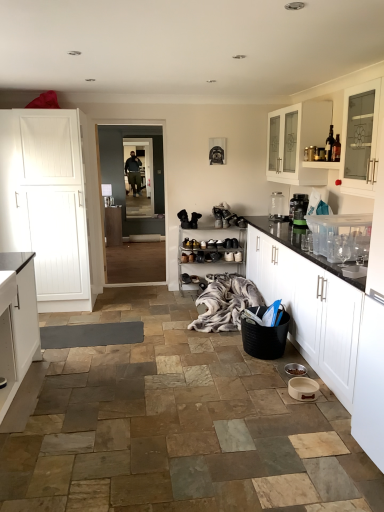
Question: Is transparent glass water bottle at upper right smaller than leather shoe at center?

Choices:
 (A) no
 (B) yes

Answer: (A)

Question: From a real-world perspective, does transparent glass water bottle at upper right stand above leather shoe at center?

Choices:
 (A) no
 (B) yes

Answer: (B)

Question: Does transparent glass water bottle at upper right have a lesser width compared to leather shoe at center?

Choices:
 (A) yes
 (B) no

Answer: (A)

Question: From a real-world perspective, is transparent glass water bottle at upper right positioned under leather shoe at center based on gravity?

Choices:
 (A) yes
 (B) no

Answer: (B)

Question: From the image's perspective, is transparent glass water bottle at upper right on leather shoe at center?

Choices:
 (A) yes
 (B) no

Answer: (A)

Question: From their relative heights in the image, would you say clear glass cabinet at upper right, the fourth cabinetry in the back-to-front sequence, is taller or shorter than leather shoe at center?

Choices:
 (A) tall
 (B) short

Answer: (A)

Question: From the image's perspective, is clear glass cabinet at upper right, which appears as the third cabinetry when viewed from the front, located above or below leather shoe at center?

Choices:
 (A) below
 (B) above

Answer: (B)

Question: Considering the positions of clear glass cabinet at upper right, acting as the 1th cabinetry starting from the right, and leather shoe at center in the image, is clear glass cabinet at upper right, acting as the 1th cabinetry starting from the right, bigger or smaller than leather shoe at center?

Choices:
 (A) small
 (B) big

Answer: (B)

Question: From a real-world perspective, is clear glass cabinet at upper right, the 6th cabinetry positioned from the left, above or below leather shoe at center?

Choices:
 (A) below
 (B) above

Answer: (B)

Question: From the image's perspective, relative to transparent glass door at center, is transparent glass water bottle at upper right above or below?

Choices:
 (A) above
 (B) below

Answer: (B)

Question: Does point (281, 203) appear closer or farther from the camera than point (127, 158)?

Choices:
 (A) closer
 (B) farther

Answer: (A)

Question: Looking at their shapes, would you say transparent glass water bottle at upper right is wider or thinner than transparent glass door at center?

Choices:
 (A) thin
 (B) wide

Answer: (B)

Question: From a real-world perspective, is transparent glass water bottle at upper right above or below transparent glass door at center?

Choices:
 (A) below
 (B) above

Answer: (A)

Question: From a real-world perspective, is black plastic basket at lower right positioned above or below white wood door at left, the 3th cabinetry positioned from the back?

Choices:
 (A) below
 (B) above

Answer: (A)

Question: Considering their positions, is black plastic basket at lower right located in front of or behind white wood door at left, which is the first cabinetry from left to right?

Choices:
 (A) behind
 (B) front

Answer: (B)